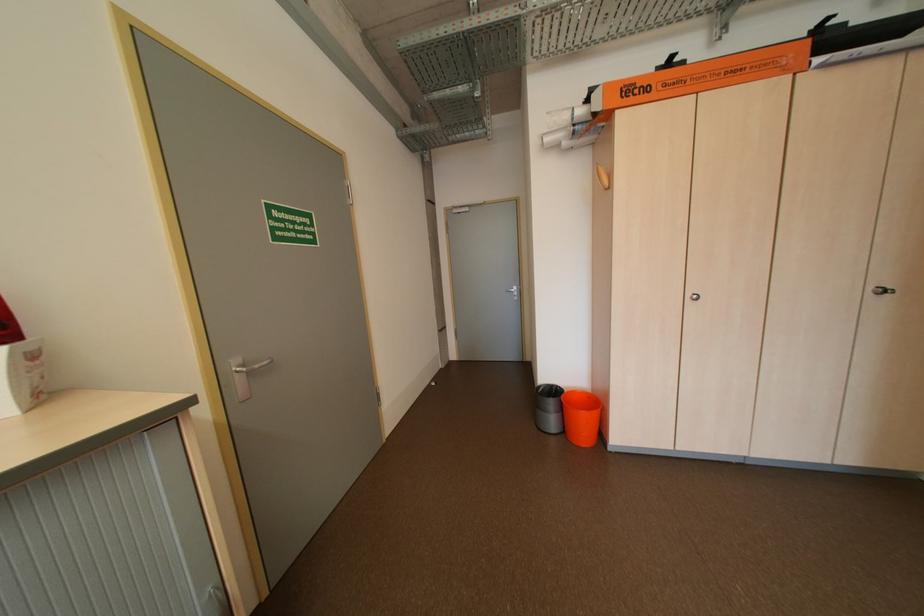
Where would you turn the silver latch handle? Please return your answer as a coordinate pair (x, y).

(244, 376)